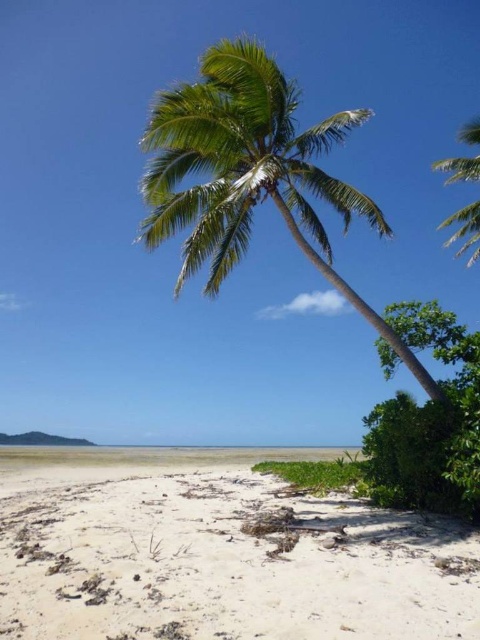
You are standing on the white sandy beach at lower center and want to reach the green leafy palm tree at center. Which direction should you walk to get there?

You should walk to the right side because the white sandy beach at lower center is positioned on the left side of the green leafy palm tree at center.

You are standing on the beach and want to take a photo of the green leafy palm tree at center. If you move 1 meter to the north, will you still be able to see the entire palm tree in your camera frame? Assume your camera has a standard 50mm lens and you are 10 meters away from the tree initially.

Since the green leafy palm tree at center is located at coordinates point (250,173), moving north by 1 meter while maintaining a distance of 10 meters would shift your position relative to the tree. However, without specific spatial dimensions or angles provided, it is impossible to definitively determine if the entire tree remains in frame. The answer requires calculations involving camera field of view and tree height, which are not provided in the given data.

You are standing on the beach and want to take a photo of the green leafy palm tree at center. If your camera has a maximum focus range of 8 meters, will it be able to capture the tree clearly?

The green leafy palm tree at center is 8.45 meters away from the viewer. Since the camera can only focus up to 8 meters, it won measurements, so the tree will be out of focus and not captured clearly.